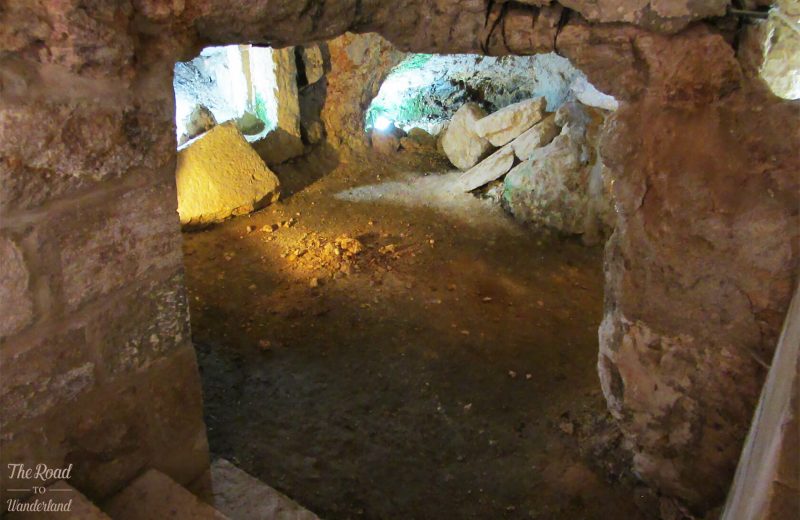
The height and width of the screenshot is (520, 800). I want to click on top step, so click(x=85, y=508).